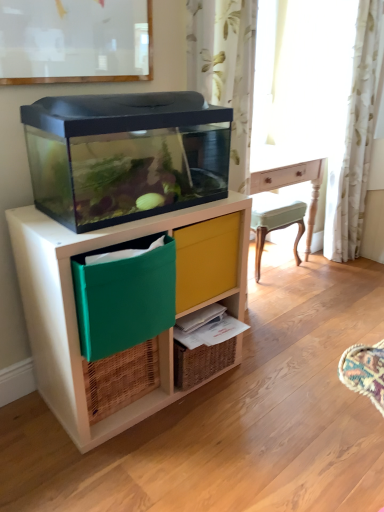
I want to click on vacant area located to the right-hand side of woven brown basket at lower left, so click(x=176, y=416).